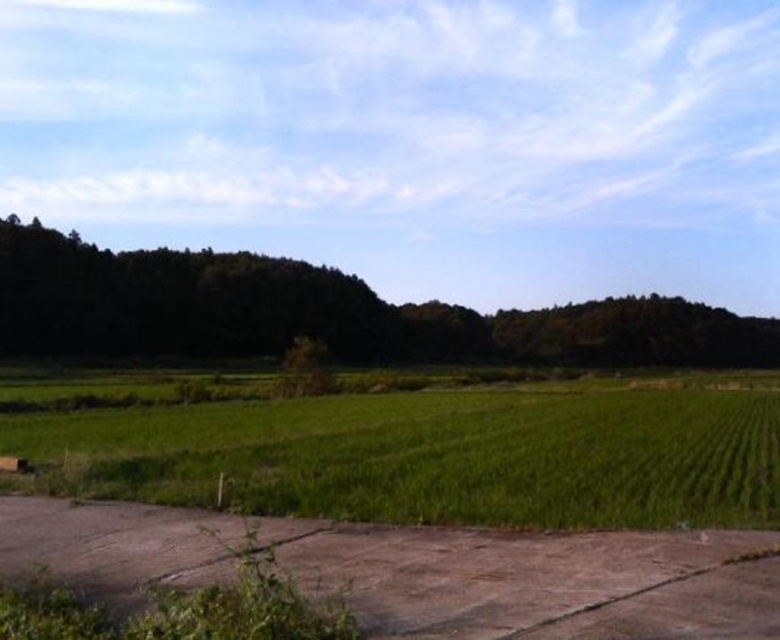
Question: Which point is closer to the camera?

Choices:
 (A) (266, 292)
 (B) (713, 432)

Answer: (B)

Question: Which object is farther from the camera taking this photo?

Choices:
 (A) green grass at lower left
 (B) dark green leafy tree at center

Answer: (B)

Question: Which point is farther to the camera?

Choices:
 (A) green grass at lower left
 (B) dark green leafy tree at center

Answer: (B)

Question: Observing the image, what is the correct spatial positioning of green grass at lower left in reference to dark green leafy tree at center?

Choices:
 (A) left
 (B) right

Answer: (A)

Question: Is green grass at lower left behind dark green leafy tree at center?

Choices:
 (A) yes
 (B) no

Answer: (B)

Question: Is green grass at lower left positioned behind dark green leafy tree at center?

Choices:
 (A) no
 (B) yes

Answer: (A)